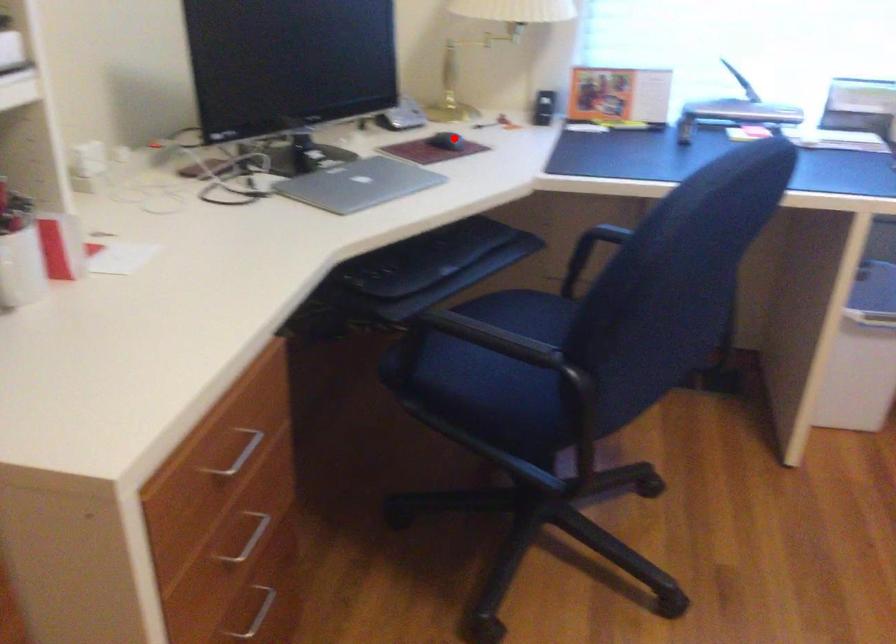
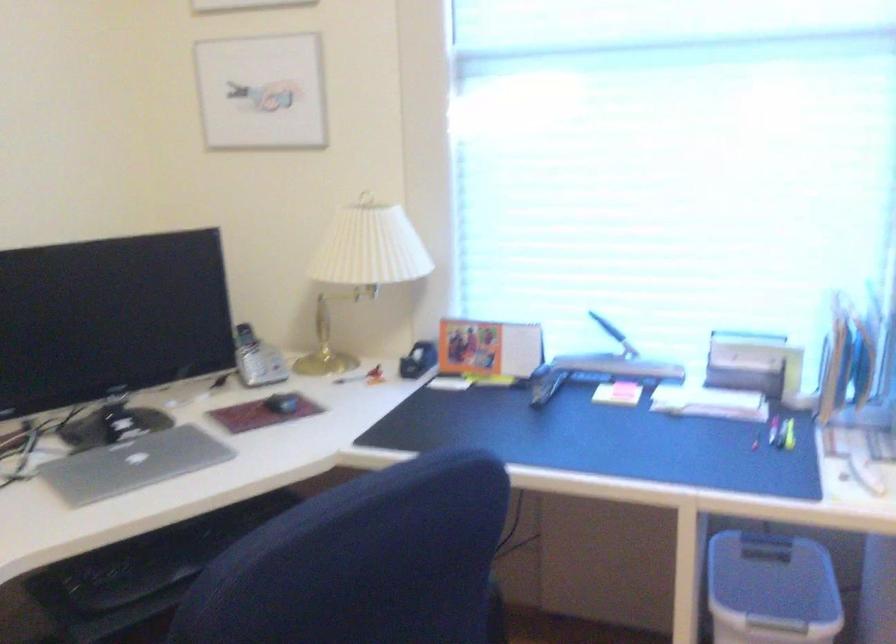
Where in the second image is the point corresponding to the highlighted location from the first image?

(281, 402)